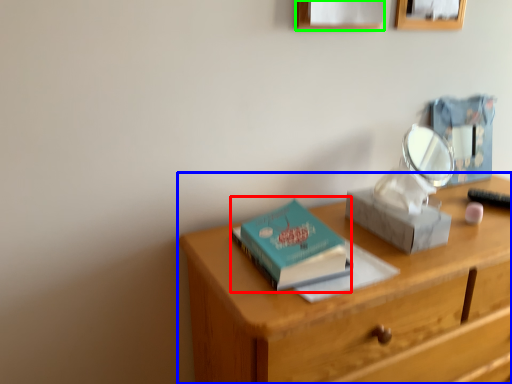
Question: Based on their relative distances, which object is nearer to paperback book (highlighted by a red box)? Choose from desk (highlighted by a blue box) and picture frame (highlighted by a green box).

Choices:
 (A) desk
 (B) picture frame

Answer: (A)